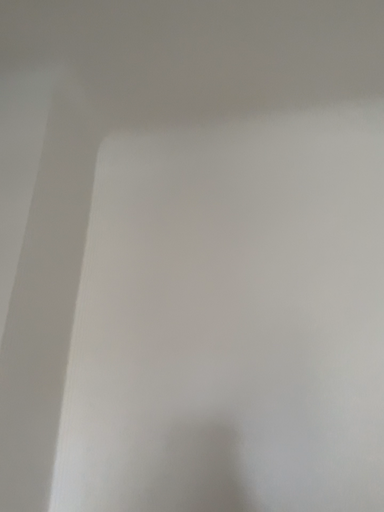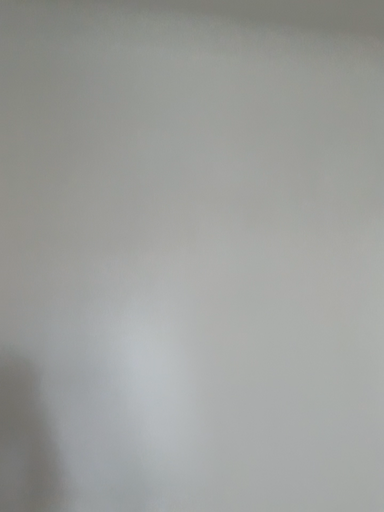
Question: Which way did the camera rotate in the video?

Choices:
 (A) rotated right
 (B) rotated left

Answer: (A)